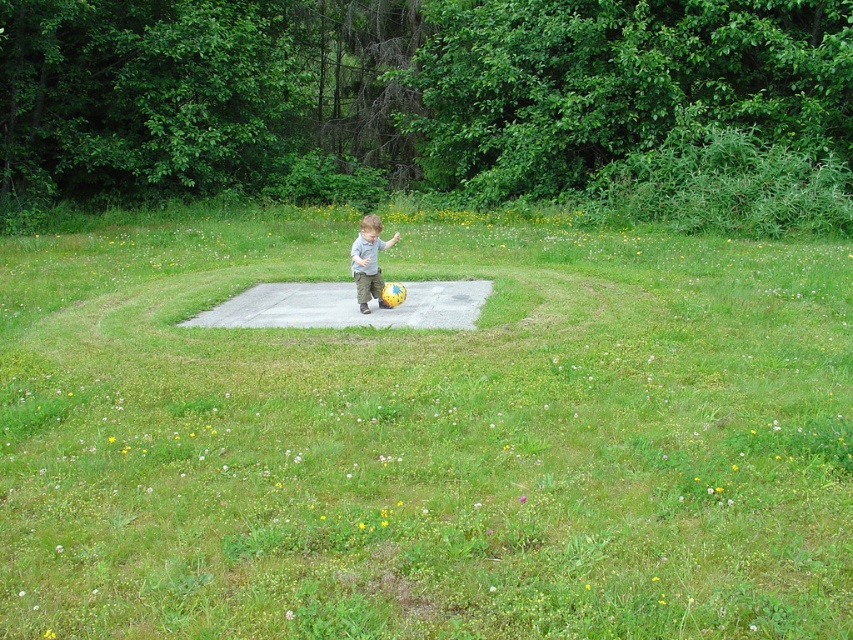
Measure the distance between concrete slab at center and camera.

3.28 meters

Is concrete slab at center above matte gray shirt at center?

No.

Between point (844, 552) and point (375, 216), which one is positioned in front?

Point (844, 552) is more forward.

Where is `concrete slab at center`? This screenshot has width=853, height=640. concrete slab at center is located at coordinates (425, 436).